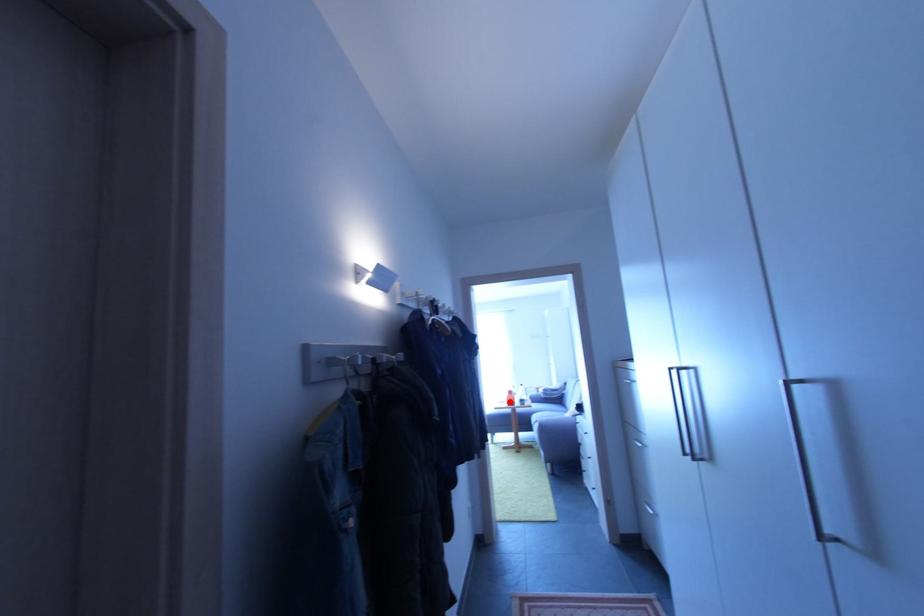
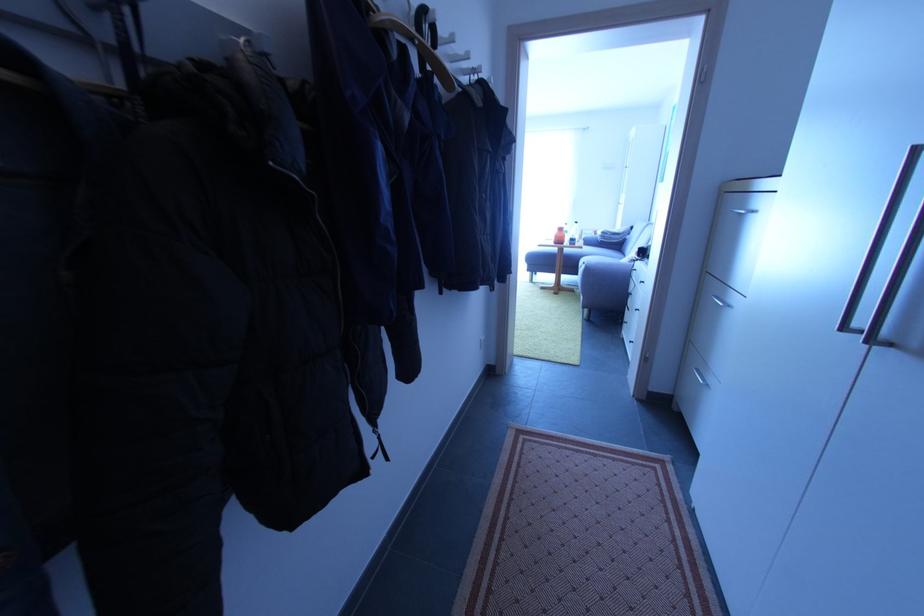
Question: I am providing you with two images of the same scene from different viewpoints. A red point is shown in image1. For the corresponding object point in image2, is it positioned nearer or farther from the camera?

Choices:
 (A) Nearer
 (B) Farther

Answer: (A)